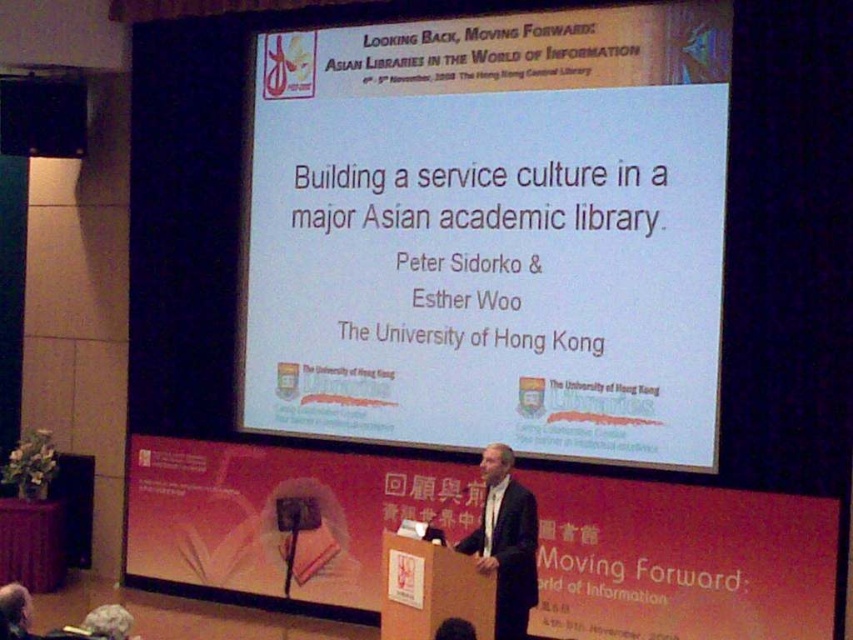
You are an event photographer at the conference. You need to capture a photo where both the white paper at center and the dark gray wool suit at center are clearly visible. Given that the white paper is wider than the dark gray wool suit, which object should you adjust your camera focus on first to ensure both are in frame?

Since the white paper at center is wider than the dark gray wool suit at center, you should first focus on the white paper at center to ensure its entire width fits within the camera frame before adjusting for the smaller dark gray wool suit at center.

You are an event organizer who needs to set up a microphone for the presenter. The microphone has a range of 5 feet. If you place it at the white paper at center, will the dark gray wool suit at center be within range?

The white paper at center and dark gray wool suit at center are 6.87 feet apart from each other. Since the microphone has a 5 feet range, the dark gray wool suit at center is outside the microphone range.

You are sitting in the audience and want to walk to the podium. You see two points marked on the floor, point (498, 300) and point (500, 568). Which point is closer to you as you approach the podium?

Point (498, 300) is closer to you because it is further to the viewer than point (500, 568).